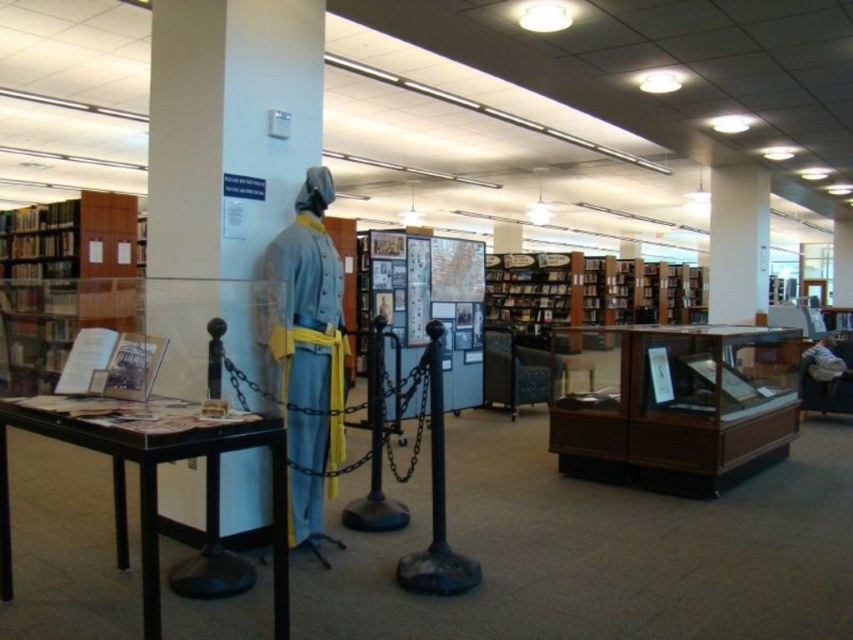
Question: Which of these objects is positioned closest to the matte paper book at left?

Choices:
 (A) wooden display case at center
 (B) matte gray pillar at center
 (C) light brown leather jacket at lower right
 (D) wooden bookshelf at left

Answer: (B)

Question: Is matte gray pillar at center to the left of black plastic table at lower left from the viewer's perspective?

Choices:
 (A) no
 (B) yes

Answer: (B)

Question: Which of the following is the closest to the observer?

Choices:
 (A) (229, 502)
 (B) (74, 276)

Answer: (A)

Question: Does brown wooden bookshelf at center have a smaller size compared to light brown leather jacket at lower right?

Choices:
 (A) no
 (B) yes

Answer: (B)

Question: Is wooden bookshelf at left smaller than light brown leather jacket at lower right?

Choices:
 (A) yes
 (B) no

Answer: (B)

Question: Which of the following is the farthest from the observer?

Choices:
 (A) (3, 252)
 (B) (242, 417)
 (C) (154, 337)

Answer: (A)